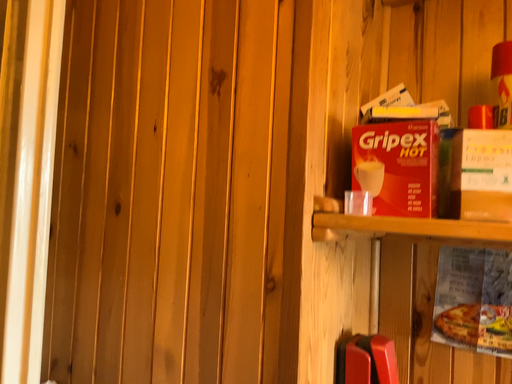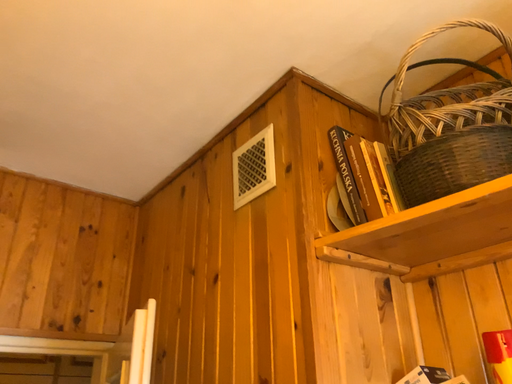
Question: Which way did the camera rotate in the video?

Choices:
 (A) rotated downward
 (B) rotated upward

Answer: (B)